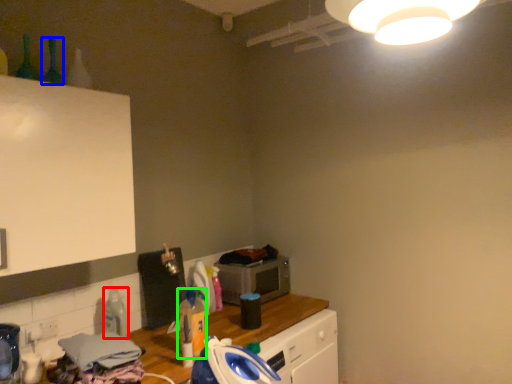
Question: Which is nearer to the bottle (highlighted by a red box)? bottle (highlighted by a blue box) or bottle (highlighted by a green box).

Choices:
 (A) bottle
 (B) bottle

Answer: (B)